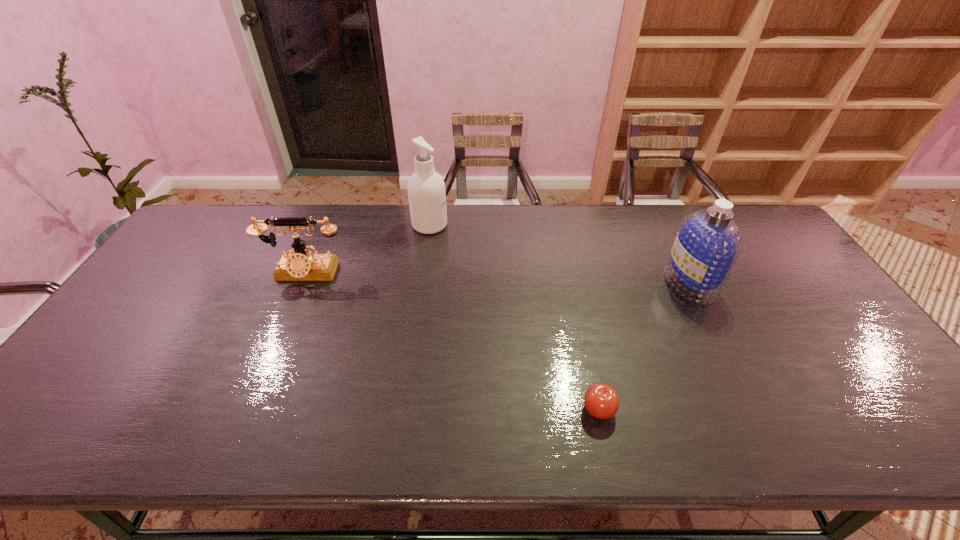
The image size is (960, 540). In order to click on object that is the closest to the farthest object in this screenshot , I will do `click(303, 265)`.

Find the location of a particular element. This screenshot has height=540, width=960. vacant position in the image that satisfies the following two spatial constraints: 1. on the front label of the nearer cleansing agent; 2. on the left side of the farthest object is located at coordinates (421, 284).

The image size is (960, 540). I want to click on free space in the image that satisfies the following two spatial constraints: 1. on the front label of the shortest object; 2. on the right side of the third object from right to left, so click(404, 409).

This screenshot has height=540, width=960. Find the location of `blank space that satisfies the following two spatial constraints: 1. on the dial of the leftmost object; 2. on the right side of the rightmost object`. blank space that satisfies the following two spatial constraints: 1. on the dial of the leftmost object; 2. on the right side of the rightmost object is located at coordinates (300, 284).

This screenshot has width=960, height=540. In order to click on vacant space that satisfies the following two spatial constraints: 1. on the front label of the nearer cleansing agent; 2. on the left side of the farther cleansing agent in this screenshot , I will do `click(421, 284)`.

Locate an element on the screen. The width and height of the screenshot is (960, 540). free space that satisfies the following two spatial constraints: 1. on the dial of the telephone; 2. on the right side of the third object from left to right is located at coordinates (247, 409).

Image resolution: width=960 pixels, height=540 pixels. What are the coordinates of `vacant area in the image that satisfies the following two spatial constraints: 1. on the front label of the farther cleansing agent; 2. on the dial of the telephone` in the screenshot? It's located at (423, 273).

Identify the location of free space that satisfies the following two spatial constraints: 1. on the dial of the shortest object; 2. on the right side of the telephone. (x=247, y=409).

At what (x,y) coordinates should I click in order to perform the action: click on vacant region that satisfies the following two spatial constraints: 1. on the front label of the nearest object; 2. on the right side of the left cleansing agent. Please return your answer as a coordinate pair (x, y). Looking at the image, I should click on (404, 409).

Identify the location of free location that satisfies the following two spatial constraints: 1. on the dial of the rightmost object; 2. on the right side of the third tallest object. (300, 284).